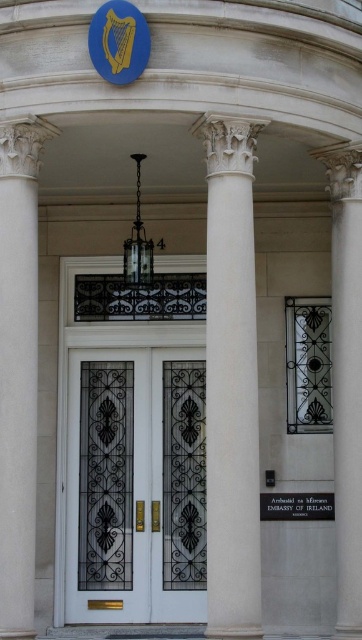
Can you confirm if white glossy door at center is positioned to the right of white marble column at left?

Yes, white glossy door at center is to the right of white marble column at left.

What do you see at coordinates (107, 486) in the screenshot?
I see `white glossy door at center` at bounding box center [107, 486].

Find the location of a particular element. white glossy door at center is located at coordinates (107, 486).

Image resolution: width=362 pixels, height=640 pixels. Find the location of `white glossy door at center`. white glossy door at center is located at coordinates (107, 486).

Can you confirm if white marble column at center is positioned above white glossy door at center?

Correct, white marble column at center is located above white glossy door at center.

In the scene shown: Who is more distant from viewer, (x=220, y=609) or (x=123, y=380)?

The point (x=123, y=380) is more distant.

This screenshot has height=640, width=362. What are the coordinates of `white marble column at center` in the screenshot? It's located at (230, 380).

Which is in front, point (208, 580) or point (355, 236)?

Positioned in front is point (208, 580).

Is point (246, 138) less distant than point (351, 406)?

That is True.

Who is more distant from viewer, (246,582) or (347,525)?

Point (347,525)

Where is `white marble column at center`? white marble column at center is located at coordinates (230, 380).